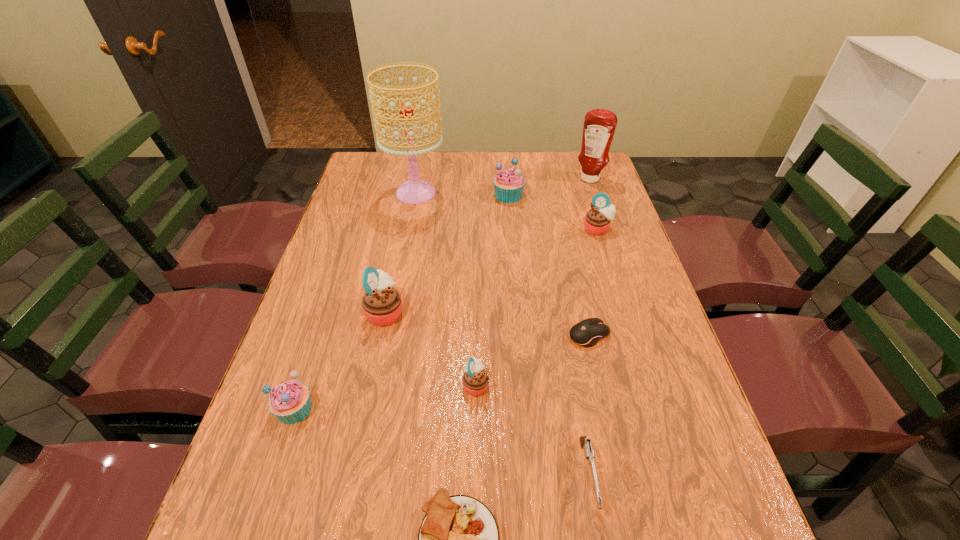
At what (x,y) coordinates should I click in order to perform the action: click on the smallest pink muffin. Please return your answer as a coordinate pair (x, y). The image size is (960, 540). Looking at the image, I should click on (475, 380).

Find the location of a particular element. The width and height of the screenshot is (960, 540). the nearer blue muffin is located at coordinates (290, 402).

The height and width of the screenshot is (540, 960). What are the coordinates of `the smaller blue muffin` in the screenshot? It's located at (290, 402).

Where is `pistol`? pistol is located at coordinates (585, 443).

What are the coordinates of `silver pistol` in the screenshot? It's located at (585, 443).

In order to click on the third object from right to left in this screenshot , I will do `click(587, 333)`.

At what (x,y) coordinates should I click in order to perform the action: click on computer mouse. Please return your answer as a coordinate pair (x, y). The image size is (960, 540). Looking at the image, I should click on (587, 333).

I want to click on vacant space situated 0.270m on the right of the tallest object, so click(525, 193).

This screenshot has width=960, height=540. Find the location of `vacant space located on the back of the ninth shortest object`. vacant space located on the back of the ninth shortest object is located at coordinates (581, 152).

Where is `vacant space situated on the front-facing side of the second farthest pink muffin`? vacant space situated on the front-facing side of the second farthest pink muffin is located at coordinates (460, 312).